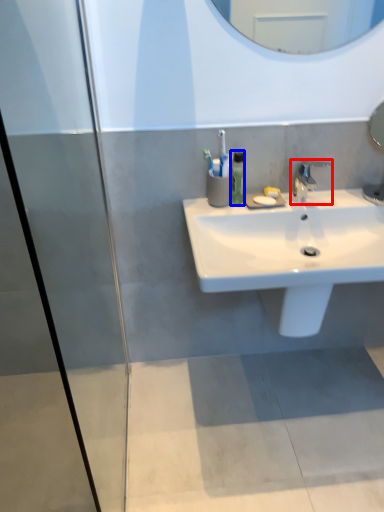
Question: Which of the following is the closest to the observer, tap (highlighted by a red box) or soap dispenser (highlighted by a blue box)?

Choices:
 (A) tap
 (B) soap dispenser

Answer: (A)